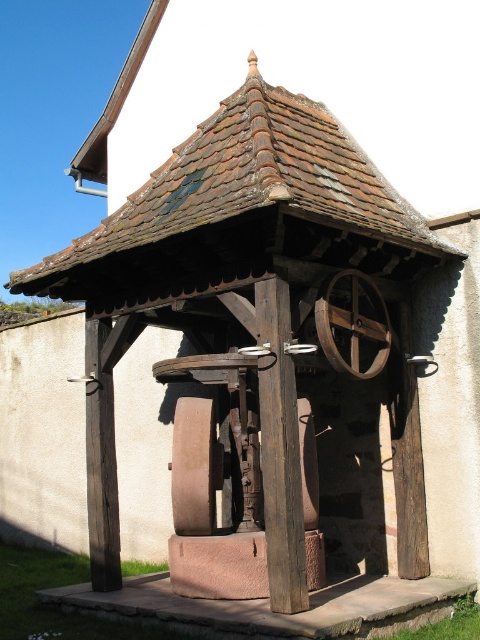
Question: Which point is closer to the camera?

Choices:
 (A) brown wooden wheel at center
 (B) wooden wheel at center

Answer: (B)

Question: Can you confirm if wooden wheel at center is positioned to the left of brown wooden wheel at center?

Choices:
 (A) yes
 (B) no

Answer: (B)

Question: Which of the following is the closest to the observer?

Choices:
 (A) wooden wheel at center
 (B) brown wooden wheel at center

Answer: (A)

Question: In this image, where is wooden wheel at center located relative to brown wooden wheel at center?

Choices:
 (A) below
 (B) above

Answer: (B)

Question: Does wooden wheel at center appear on the right side of brown wooden wheel at center?

Choices:
 (A) no
 (B) yes

Answer: (B)